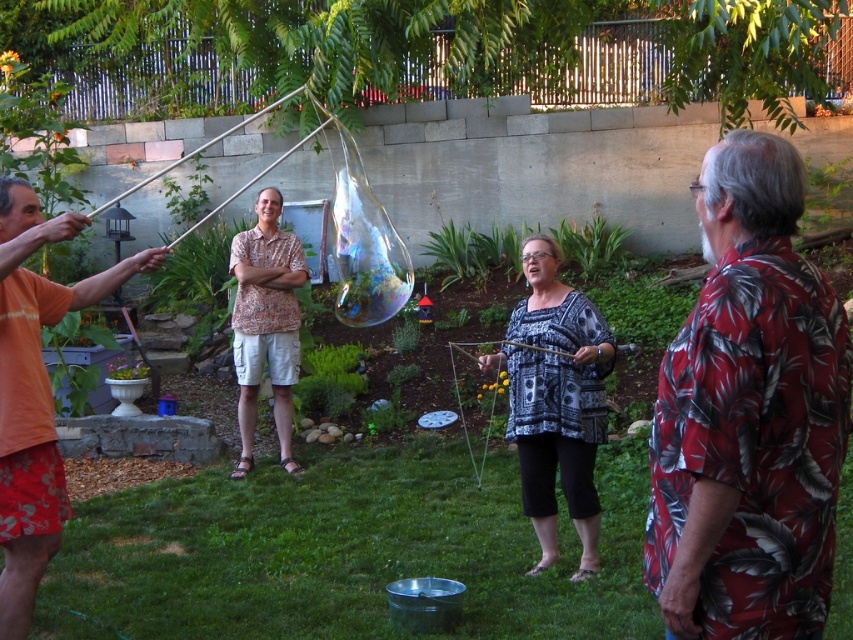
Question: Is orange tie-dye shirt at left to the right of patterned fabric blouse at center from the viewer's perspective?

Choices:
 (A) no
 (B) yes

Answer: (A)

Question: Based on their relative distances, which object is nearer to the printed fabric shirt at center?

Choices:
 (A) orange tie-dye shirt at left
 (B) red floral shirt at right

Answer: (A)

Question: Does red floral shirt at right have a smaller size compared to patterned fabric blouse at center?

Choices:
 (A) yes
 (B) no

Answer: (A)

Question: Which object is the closest to the red floral shirt at right?

Choices:
 (A) orange tie-dye shirt at left
 (B) patterned fabric blouse at center
 (C) printed fabric shirt at center

Answer: (A)

Question: Observing the image, what is the correct spatial positioning of red floral shirt at right in reference to printed fabric shirt at center?

Choices:
 (A) left
 (B) right

Answer: (B)

Question: Considering the real-world distances, which object is closest to the orange tie-dye shirt at left?

Choices:
 (A) printed fabric shirt at center
 (B) patterned fabric blouse at center
 (C) red floral shirt at right

Answer: (B)